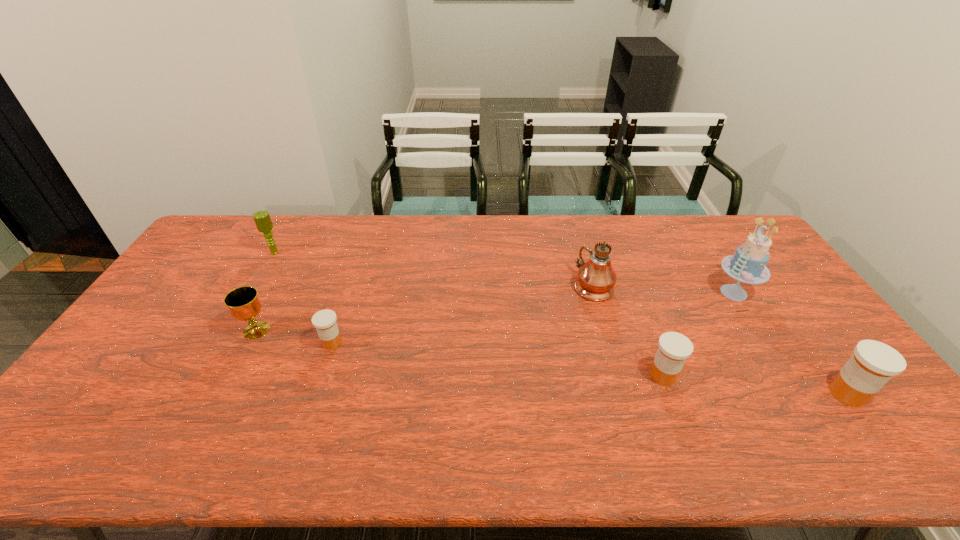
Where is `location for an additional medicine to make spacing equal`? The image size is (960, 540). location for an additional medicine to make spacing equal is located at coordinates (492, 359).